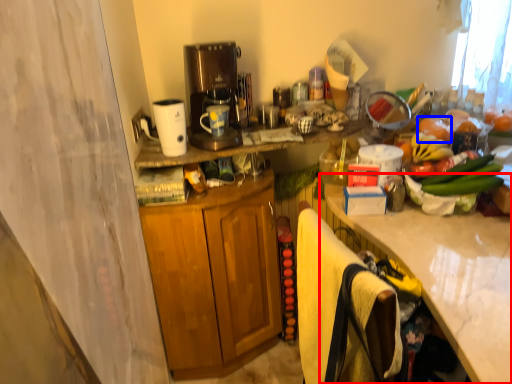
Question: Which object is further to the camera taking this photo, countertop (highlighted by a red box) or fruit (highlighted by a blue box)?

Choices:
 (A) countertop
 (B) fruit

Answer: (B)